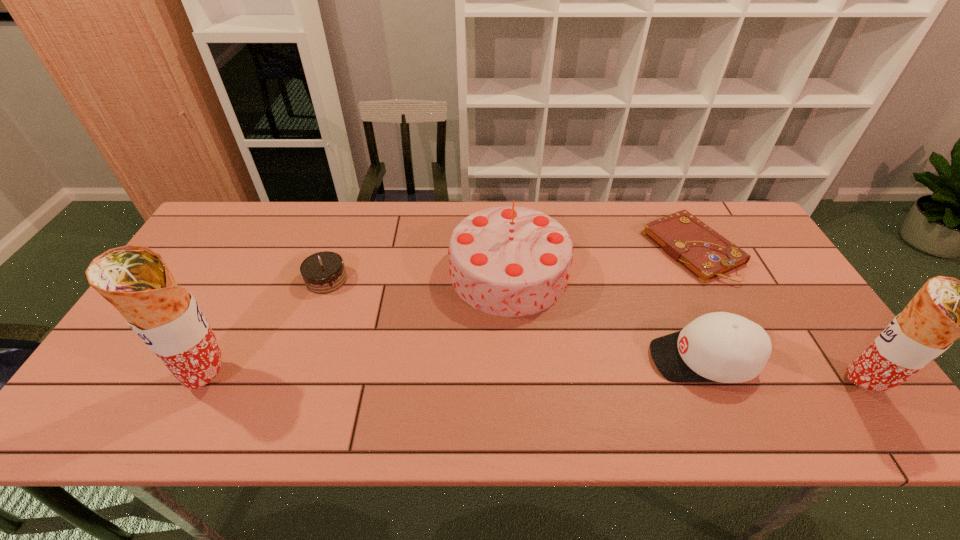
Where is `baseball cap located at the near edge`? The image size is (960, 540). baseball cap located at the near edge is located at coordinates (724, 347).

Identify the location of burrito that is positioned at the right edge. This screenshot has height=540, width=960. (944, 309).

At what (x,y) coordinates should I click in order to perform the action: click on notebook present at the right edge. Please return your answer as a coordinate pair (x, y). The height and width of the screenshot is (540, 960). Looking at the image, I should click on (705, 253).

Find the location of a particular element. Image resolution: width=960 pixels, height=540 pixels. object located in the far right corner section of the desktop is located at coordinates (705, 253).

Identify the location of object that is at the near right corner. The width and height of the screenshot is (960, 540). (944, 309).

The height and width of the screenshot is (540, 960). I want to click on free space at the far edge of the desktop, so (276, 214).

In order to click on vacant space at the near edge in this screenshot , I will do 382,380.

Where is `vacant space at the left edge`? The width and height of the screenshot is (960, 540). vacant space at the left edge is located at coordinates (144, 359).

What are the coordinates of `free space between the fifth tallest object and the third shortest object` in the screenshot? It's located at (515, 319).

This screenshot has width=960, height=540. I want to click on unoccupied position between the leftmost object and the fifth shortest object, so click(x=536, y=381).